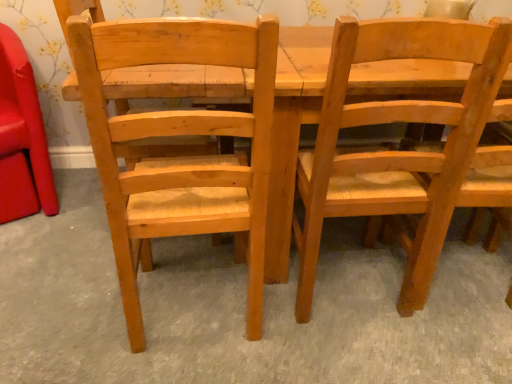
Question: In terms of width, does natural wood chair at left, which appears as the second chair when viewed from the left, look wider or thinner when compared to light brown wood chair at center, acting as the first chair starting from the right?

Choices:
 (A) thin
 (B) wide

Answer: (A)

Question: From a real-world perspective, is natural wood chair at left, marked as the second chair in a right-to-left arrangement, physically located above or below light brown wood chair at center, the 3th chair in the left-to-right sequence?

Choices:
 (A) below
 (B) above

Answer: (B)

Question: Estimate the real-world distances between objects in this image. Which object is closer to the matte wood chair at left, which is the first chair from left to right?

Choices:
 (A) light brown wood chair at center, the 3th chair in the left-to-right sequence
 (B) natural wood chair at left, which appears as the second chair when viewed from the left

Answer: (B)

Question: Which object is the closest to the natural wood chair at left, marked as the second chair in a right-to-left arrangement?

Choices:
 (A) matte wood chair at left, which appears as the 3th chair when viewed from the right
 (B) light brown wood chair at center, acting as the first chair starting from the right

Answer: (B)